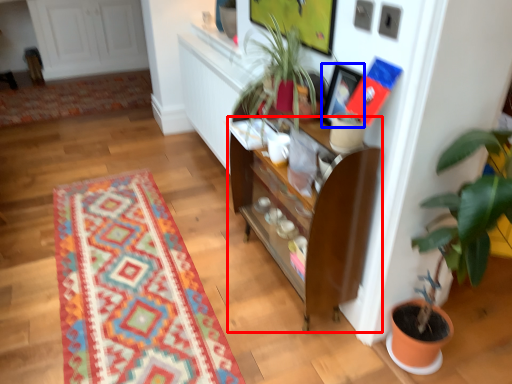
Question: Which object is further to the camera taking this photo, cabinetry (highlighted by a red box) or picture frame (highlighted by a blue box)?

Choices:
 (A) cabinetry
 (B) picture frame

Answer: (B)